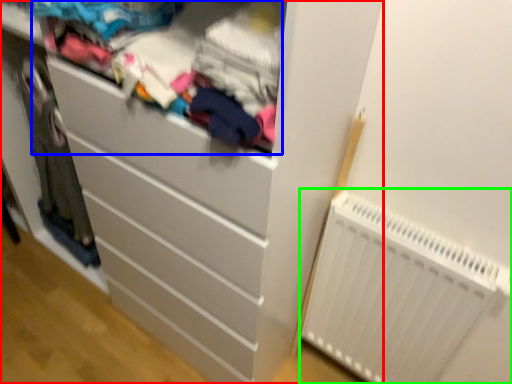
Question: Which object is the closest to the chest of drawers (highlighted by a red box)? Choose among these: clothing (highlighted by a blue box) or radiator (highlighted by a green box).

Choices:
 (A) clothing
 (B) radiator

Answer: (A)